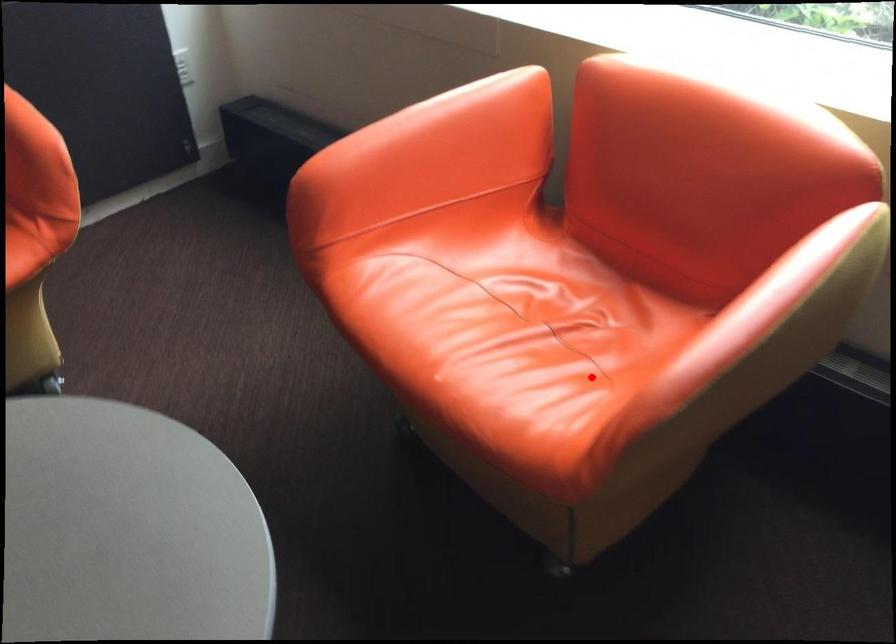
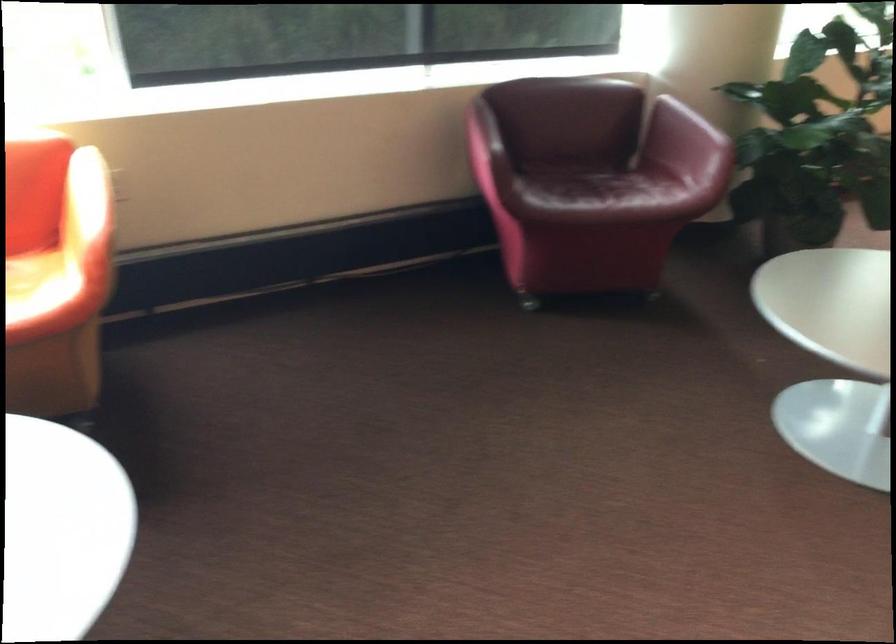
Question: I am providing you with two images of the same scene from different viewpoints. Image1 has a red point marked. In image2, the corresponding 3D location appears at what relative position? Reply with the corresponding letter.

Choices:
 (A) Closer
 (B) Farther

Answer: (B)